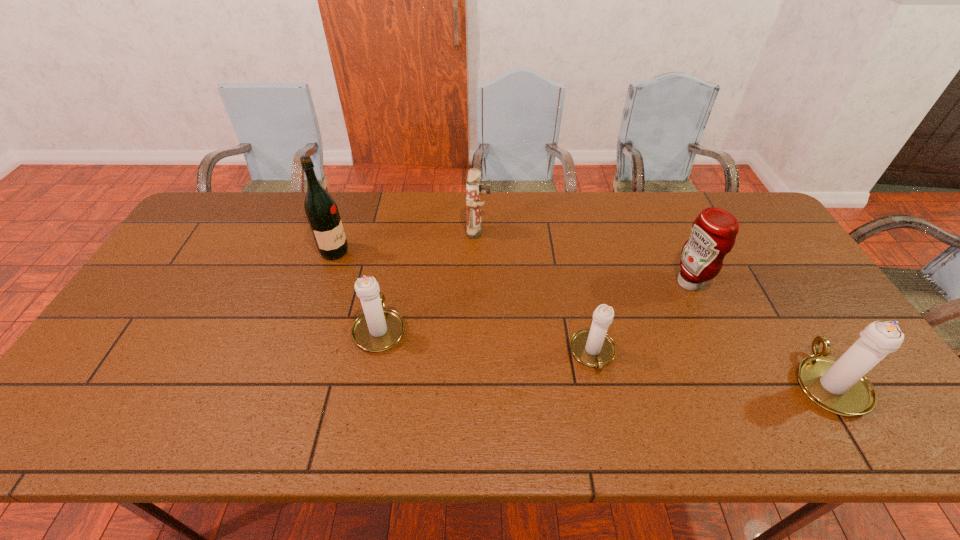
What are the coordinates of `vacant region between the fifth nearest object and the farthest object` in the screenshot? It's located at (407, 242).

Image resolution: width=960 pixels, height=540 pixels. I want to click on free space between the second tallest candle holder and the fourth object from right to left, so click(429, 280).

Where is `unoccupied area between the rightmost candle holder and the fourth nearest object`? The height and width of the screenshot is (540, 960). unoccupied area between the rightmost candle holder and the fourth nearest object is located at coordinates (758, 332).

At what (x,y) coordinates should I click in order to perform the action: click on unoccupied position between the rightmost object and the fifth object from left to right. Please return your answer as a coordinate pair (x, y). The image size is (960, 540). Looking at the image, I should click on (758, 332).

At what (x,y) coordinates should I click in order to perform the action: click on vacant region between the second object from left to right and the fourth object from left to right. Please return your answer as a coordinate pair (x, y). The height and width of the screenshot is (540, 960). Looking at the image, I should click on (487, 341).

This screenshot has width=960, height=540. What are the coordinates of `vacant area that lies between the rightmost object and the fourth nearest object` in the screenshot? It's located at (758, 332).

The image size is (960, 540). What are the coordinates of `empty location between the tallest object and the rightmost candle holder` in the screenshot? It's located at (582, 317).

I want to click on object that is the third nearest to the condiment, so click(x=473, y=204).

Select which object appears as the third closest to the tallest object. Please provide its 2D coordinates. Your answer should be formatted as a tuple, i.e. [(x, y)], where the tuple contains the x and y coordinates of a point satisfying the conditions above.

[(592, 347)]

Select which candle holder appears as the third closest to the second farthest object. Please provide its 2D coordinates. Your answer should be formatted as a tuple, i.e. [(x, y)], where the tuple contains the x and y coordinates of a point satisfying the conditions above.

[(839, 385)]